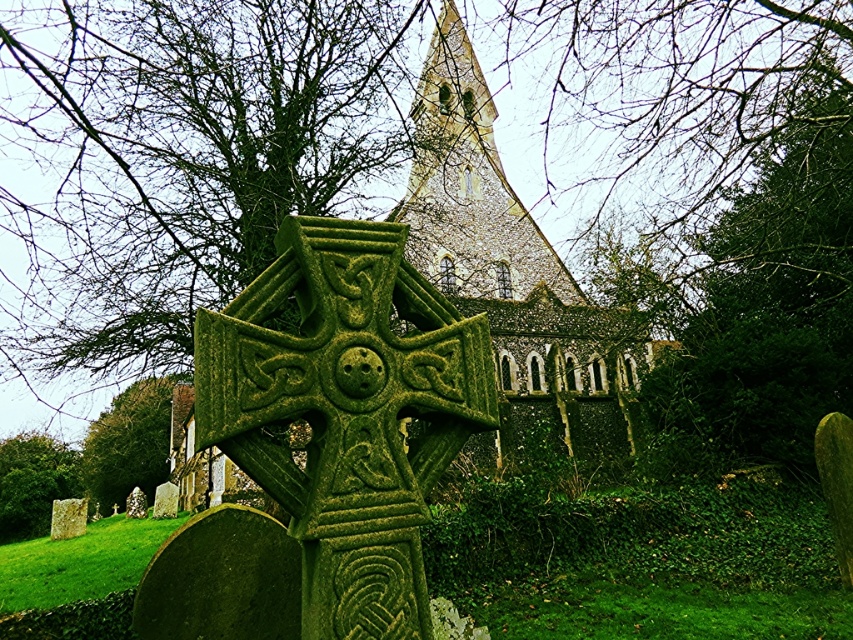
Question: Which point is closer to the camera?

Choices:
 (A) (415, 637)
 (B) (15, 468)

Answer: (A)

Question: Does green mossy tree at lower left come in front of green mossy stone at lower left?

Choices:
 (A) no
 (B) yes

Answer: (A)

Question: Estimate the real-world distances between objects in this image. Which object is closer to the green mossy gravestone at lower left?

Choices:
 (A) green mossy stone at lower left
 (B) green mossy stone cross at center

Answer: (A)

Question: Is green mossy stone at lower left above green mossy gravestone at lower left?

Choices:
 (A) no
 (B) yes

Answer: (A)

Question: Can you confirm if green mossy tree at lower left is positioned below green mossy stone at lower left?

Choices:
 (A) yes
 (B) no

Answer: (B)

Question: Among these points, which one is farthest from the camera?

Choices:
 (A) (16, 492)
 (B) (90, 445)
 (C) (318, 444)

Answer: (B)